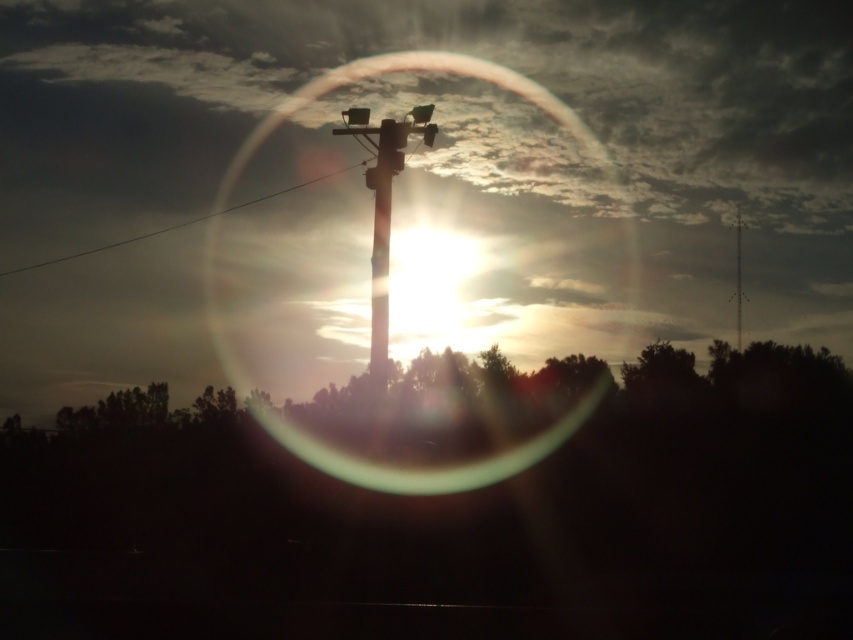
Question: Which object is closer to the camera taking this photo?

Choices:
 (A) transparent glass bubble at center
 (B) smooth wood telegraph pole at upper center
 (C) smooth wood telegraph pole at center
 (D) black wire at upper left

Answer: (A)

Question: Does transparent glass bubble at center have a smaller size compared to smooth wood telegraph pole at upper center?

Choices:
 (A) yes
 (B) no

Answer: (B)

Question: Among these objects, which one is nearest to the camera?

Choices:
 (A) smooth wood telegraph pole at upper center
 (B) transparent glass bubble at center
 (C) smooth wood telegraph pole at center

Answer: (B)

Question: Considering the real-world distances, which object is farthest from the transparent glass bubble at center?

Choices:
 (A) smooth wood telegraph pole at center
 (B) smooth wood telegraph pole at upper center
 (C) black wire at upper left

Answer: (B)

Question: Is smooth wood telegraph pole at center smaller than black wire at upper left?

Choices:
 (A) no
 (B) yes

Answer: (B)

Question: Is smooth wood telegraph pole at center closer to camera compared to smooth wood telegraph pole at upper center?

Choices:
 (A) yes
 (B) no

Answer: (A)